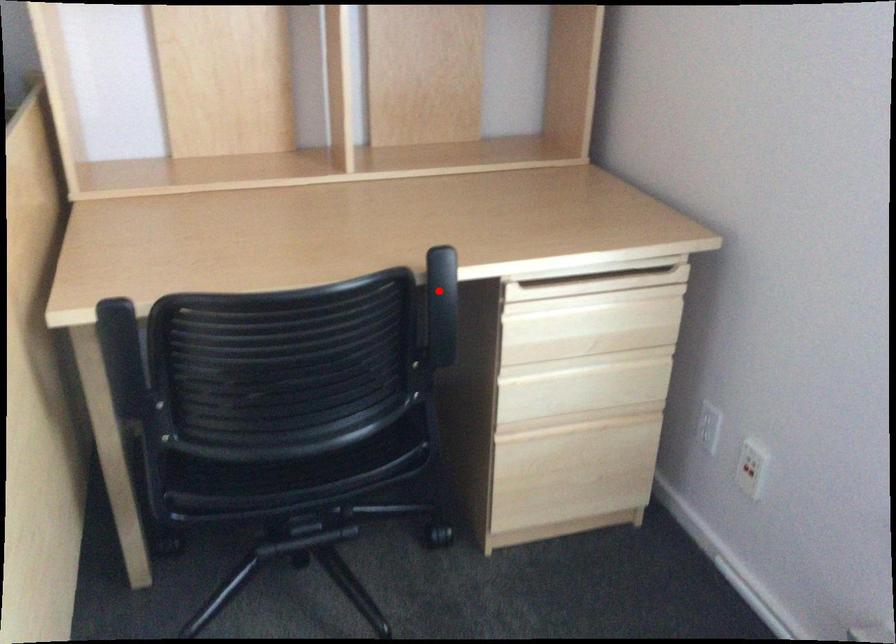
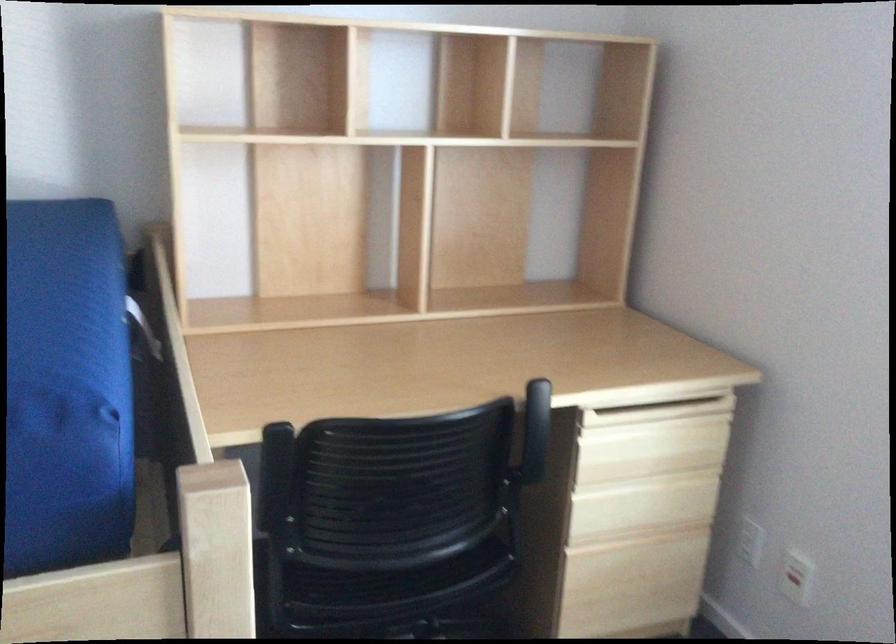
The point at the highlighted location is marked in the first image. Where is the corresponding point in the second image?

(536, 417)